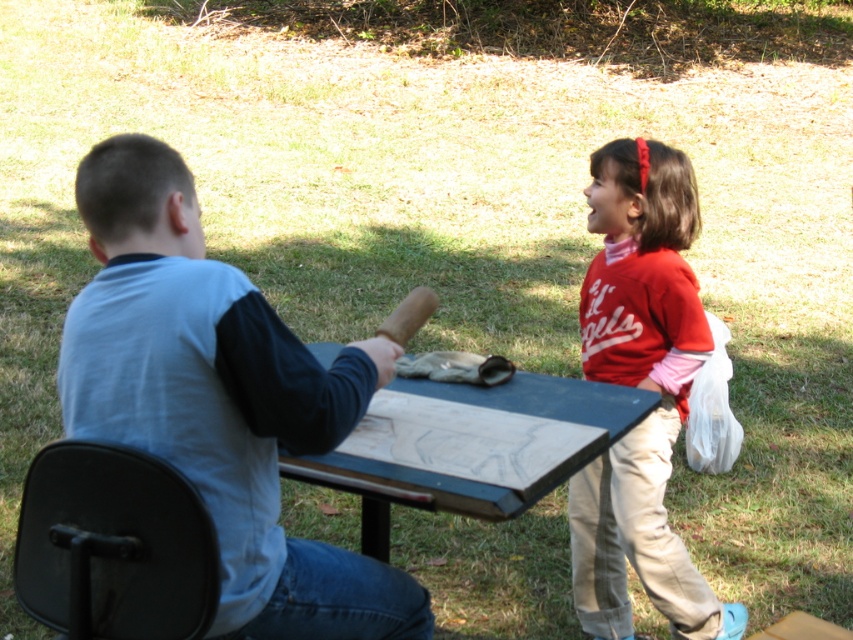
Question: Which point appears farthest from the camera in this image?

Choices:
 (A) (323, 401)
 (B) (55, 500)
 (C) (605, 282)
 (D) (462, 556)

Answer: (D)

Question: Among these objects, which one is nearest to the camera?

Choices:
 (A) black plastic chair at lower left
 (B) light blue cotton shirt at left
 (C) blue painted wood picnic table at center
 (D) matte red shirt at right

Answer: (A)

Question: In this image, where is matte red shirt at right located relative to blue painted wood picnic table at center?

Choices:
 (A) below
 (B) above

Answer: (B)

Question: Is the position of light blue cotton shirt at left less distant than that of black plastic chair at lower left?

Choices:
 (A) yes
 (B) no

Answer: (B)

Question: Considering the relative positions of light blue cotton shirt at left and matte red shirt at right in the image provided, where is light blue cotton shirt at left located with respect to matte red shirt at right?

Choices:
 (A) right
 (B) left

Answer: (B)

Question: Which object appears farthest from the camera in this image?

Choices:
 (A) matte red shirt at right
 (B) blue painted wood picnic table at center
 (C) black plastic chair at lower left

Answer: (B)